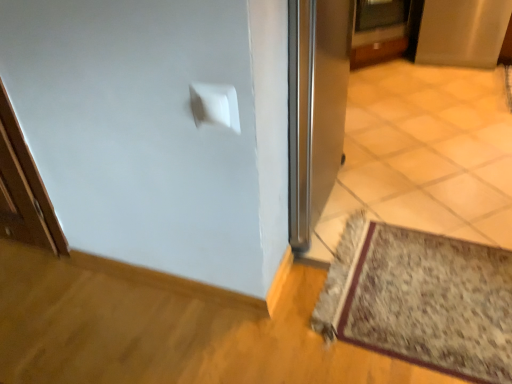
You are a GUI agent. You are given a task and a screenshot of the screen. Output one action in this format:
    pyautogui.click(x=<x>, y=<y>)
    Task: Click on the metallic silver door at upper center
    This screenshot has width=512, height=384.
    Given the screenshot: What is the action you would take?
    pyautogui.click(x=379, y=31)

From a real-world perspective, who is located lower, floral carpet at lower right or satin silver screen door at upper right?

floral carpet at lower right.

From the image's perspective, is floral carpet at lower right over satin silver screen door at upper right?

No, from the image's perspective, floral carpet at lower right is not on top of satin silver screen door at upper right.

Is floral carpet at lower right not near satin silver screen door at upper right?

floral carpet at lower right is positioned a significant distance from satin silver screen door at upper right.

Is floral carpet at lower right wider or thinner than satin silver screen door at upper right?

In the image, floral carpet at lower right appears to be more narrow than satin silver screen door at upper right.

From a real-world perspective, is metallic silver door at upper center located higher than floral carpet at lower right?

Yes, from a real-world perspective, metallic silver door at upper center is on top of floral carpet at lower right.

Which object is further away from the camera taking this photo, metallic silver door at upper center or floral carpet at lower right?

metallic silver door at upper center is behind.

From their relative heights in the image, would you say metallic silver door at upper center is taller or shorter than floral carpet at lower right?

Considering their sizes, metallic silver door at upper center has more height than floral carpet at lower right.

What's the angular difference between metallic silver door at upper center and floral carpet at lower right's facing directions?

51.3 degrees separate the facing orientations of metallic silver door at upper center and floral carpet at lower right.

Considering the positions of objects satin silver screen door at upper right and floral carpet at lower right in the image provided, who is in front, satin silver screen door at upper right or floral carpet at lower right?

floral carpet at lower right is in front.

From a real-world perspective, is satin silver screen door at upper right over floral carpet at lower right?

Yes, from a real-world perspective, satin silver screen door at upper right is above floral carpet at lower right.

Which is behind, point (500, 17) or point (488, 338)?

The point (500, 17) is farther from the camera.

Can you tell me how much satin silver screen door at upper right and floral carpet at lower right differ in facing direction?

3.28 degrees separate the facing orientations of satin silver screen door at upper right and floral carpet at lower right.

Is satin silver screen door at upper right in front of or behind metallic silver door at upper center in the image?

satin silver screen door at upper right is in front of metallic silver door at upper center.

Can you confirm if satin silver screen door at upper right is bigger than metallic silver door at upper center?

Yes.

Which object is positioned more to the right, satin silver screen door at upper right or metallic silver door at upper center?

Positioned to the right is satin silver screen door at upper right.

In terms of width, does metallic silver door at upper center look wider or thinner when compared to satin silver screen door at upper right?

Considering their sizes, metallic silver door at upper center looks slimmer than satin silver screen door at upper right.

From the image's perspective, is metallic silver door at upper center under satin silver screen door at upper right?

No, from the image's perspective, metallic silver door at upper center is not beneath satin silver screen door at upper right.

Considering the positions of objects metallic silver door at upper center and satin silver screen door at upper right in the image provided, who is behind, metallic silver door at upper center or satin silver screen door at upper right?

metallic silver door at upper center is more distant.

Which is more to the right, metallic silver door at upper center or satin silver screen door at upper right?

satin silver screen door at upper right.

From their relative heights in the image, would you say floral carpet at lower right is taller or shorter than metallic silver door at upper center?

In the image, floral carpet at lower right appears to be shorter than metallic silver door at upper center.

Image resolution: width=512 pixels, height=384 pixels. Identify the location of door on the right of floral carpet at lower right. (379, 31).

Looking at this image, is metallic silver door at upper center at the back of floral carpet at lower right?

No, floral carpet at lower right is not facing away from metallic silver door at upper center.

Visually, is floral carpet at lower right positioned to the left or to the right of metallic silver door at upper center?

floral carpet at lower right is positioned on metallic silver door at upper center's left side.

Image resolution: width=512 pixels, height=384 pixels. What are the coordinates of `screen door to the right of floral carpet at lower right` in the screenshot? It's located at (462, 32).

Where is `mat to the left of metallic silver door at upper center`? mat to the left of metallic silver door at upper center is located at coordinates (421, 299).

From the image, which object appears to be farther from floral carpet at lower right, satin silver screen door at upper right or metallic silver door at upper center?

The object further to floral carpet at lower right is satin silver screen door at upper right.

When comparing their distances from metallic silver door at upper center, does satin silver screen door at upper right or floral carpet at lower right seem closer?

satin silver screen door at upper right.

Looking at the image, which one is located closer to satin silver screen door at upper right, metallic silver door at upper center or floral carpet at lower right?

The object closer to satin silver screen door at upper right is metallic silver door at upper center.

Based on their spatial positions, is floral carpet at lower right or satin silver screen door at upper right further from metallic silver door at upper center?

Based on the image, floral carpet at lower right appears to be further to metallic silver door at upper center.

Considering their positions, is metallic silver door at upper center positioned closer to floral carpet at lower right than satin silver screen door at upper right?

Based on the image, metallic silver door at upper center appears to be nearer to floral carpet at lower right.

Looking at the image, which one is located closer to satin silver screen door at upper right, floral carpet at lower right or metallic silver door at upper center?

metallic silver door at upper center.

You are a GUI agent. You are given a task and a screenshot of the screen. Output one action in this format:
    pyautogui.click(x=<x>, y=<y>)
    Task: Click on the screen door that lies between metallic silver door at upper center and floral carpet at lower right from top to bottom
    The width and height of the screenshot is (512, 384).
    Given the screenshot: What is the action you would take?
    [462, 32]